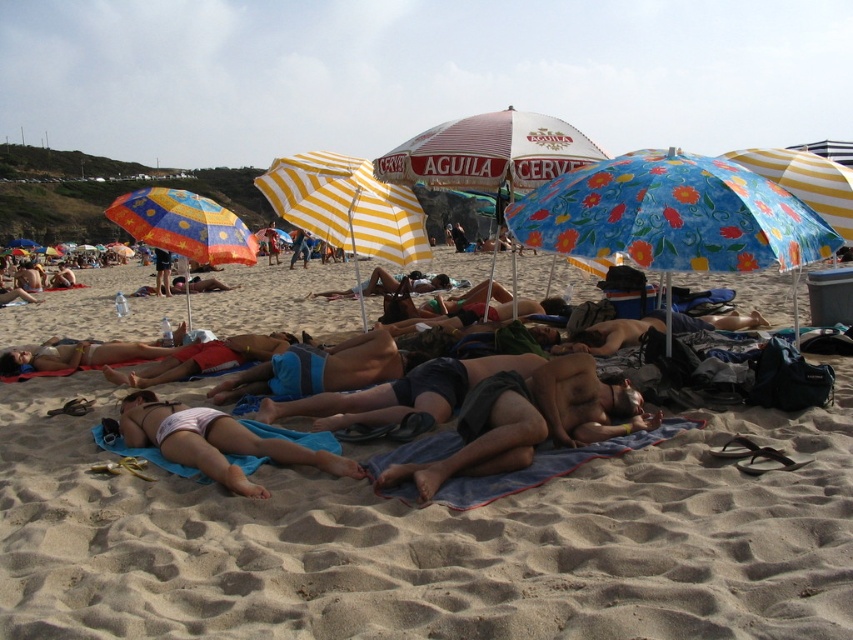
Question: Does matte blue towel at center appear on the left side of yellow striped umbrella at center?

Choices:
 (A) yes
 (B) no

Answer: (A)

Question: Which point is farther to the camera?

Choices:
 (A) matte blue towel at center
 (B) matte white bikini at center
 (C) white and red striped umbrella at center
 (D) yellow striped umbrella at center

Answer: (B)

Question: Is dark gray shorts at center to the right of yellow striped umbrella at center from the viewer's perspective?

Choices:
 (A) yes
 (B) no

Answer: (A)

Question: Which point is closer to the camera?

Choices:
 (A) (514, 380)
 (B) (213, 454)
 (C) (589, 586)
 (D) (640, 259)

Answer: (C)

Question: From the image, what is the correct spatial relationship of dark gray shorts at center in relation to matte white bikini at center?

Choices:
 (A) right
 (B) left

Answer: (A)

Question: Which object is positioned closest to the floral fabric umbrella at center?

Choices:
 (A) white fabric bikini at center
 (B) dark gray shorts at center

Answer: (B)